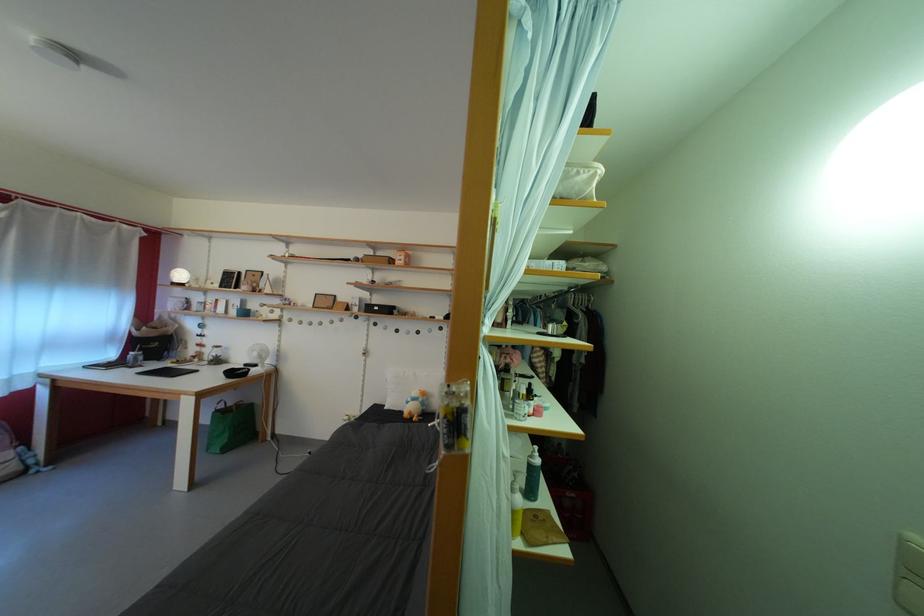
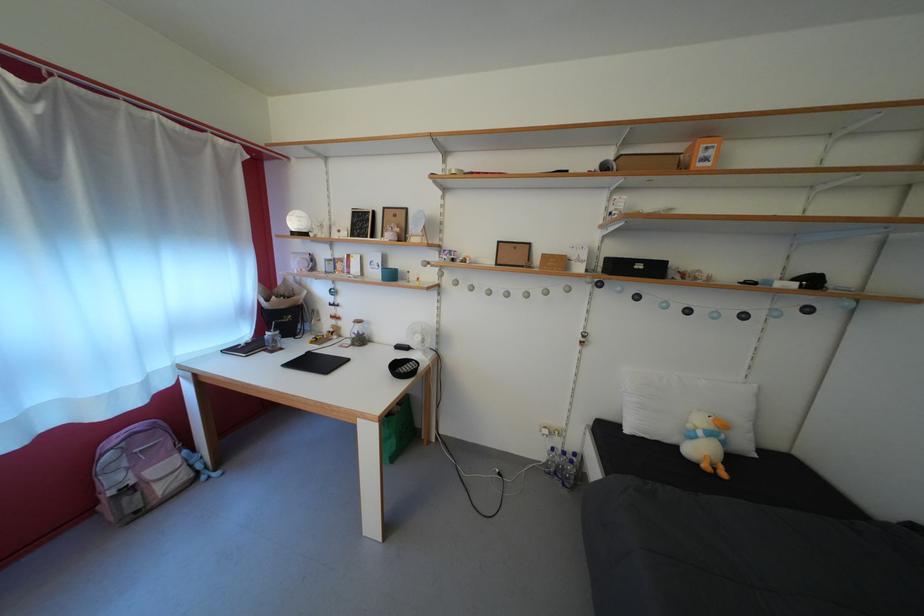
The point at (219, 360) is marked in the first image. Where is the corresponding point in the second image?

(358, 334)